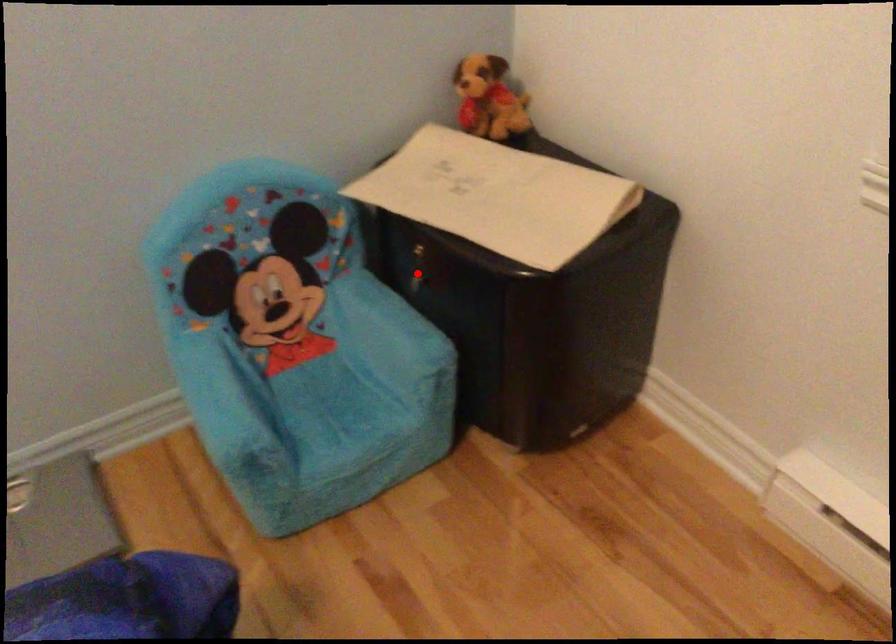
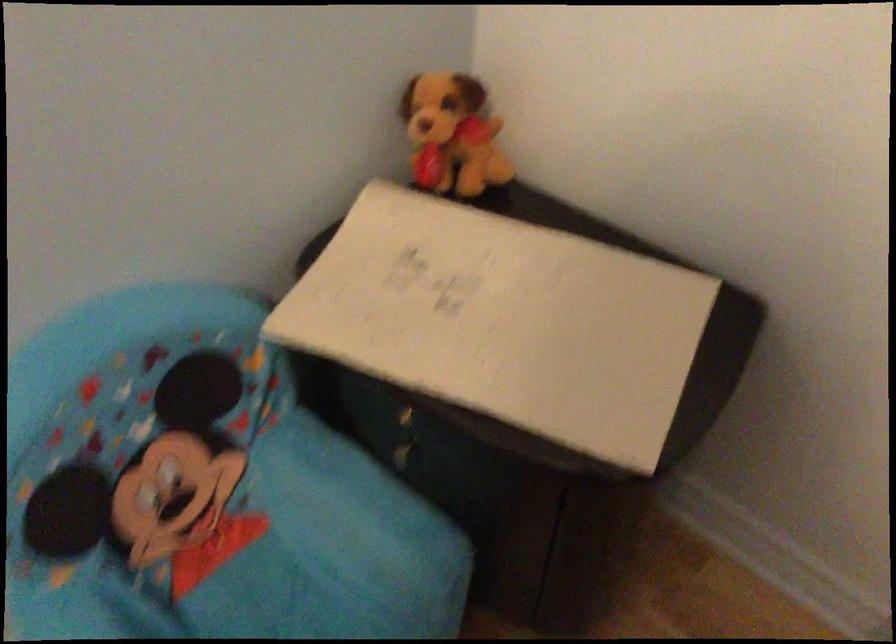
Question: I am providing you with two images of the same scene from different viewpoints. A red point is shown in image1. For the corresponding object point in image2, is it positioned nearer or farther from the camera?

Choices:
 (A) Nearer
 (B) Farther

Answer: (A)